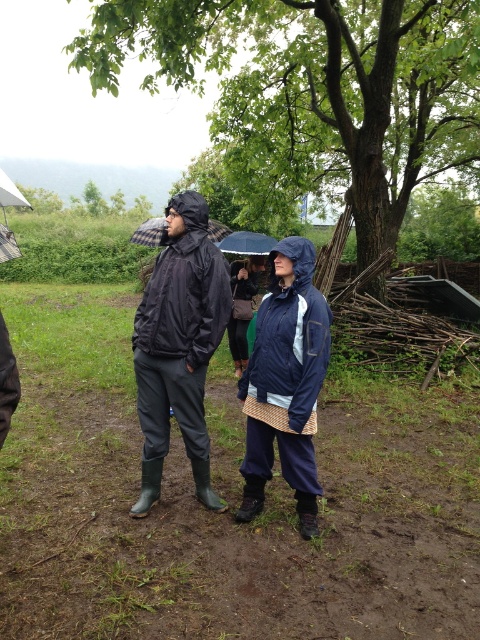
Question: Does green leafy tree at upper center appear on the left side of white matte umbrella at upper left?

Choices:
 (A) no
 (B) yes

Answer: (A)

Question: Is matte black jacket at center thinner than black matte umbrella at center?

Choices:
 (A) no
 (B) yes

Answer: (A)

Question: Considering the relative positions of green leafy tree at upper center and black matte umbrella at upper center in the image provided, where is green leafy tree at upper center located with respect to black matte umbrella at upper center?

Choices:
 (A) above
 (B) below

Answer: (A)

Question: Based on their relative distances, which object is farther from the black matte umbrella at upper center?

Choices:
 (A) matte black jacket at center
 (B) white matte umbrella at upper left

Answer: (B)

Question: Which point is closer to the camera?

Choices:
 (A) navy blue waterproof jacket at center
 (B) white matte umbrella at upper left
 (C) black matte umbrella at center
 (D) green leafy tree at upper center

Answer: (A)

Question: Among these points, which one is nearest to the camera?

Choices:
 (A) (263, 246)
 (B) (143, 228)

Answer: (B)